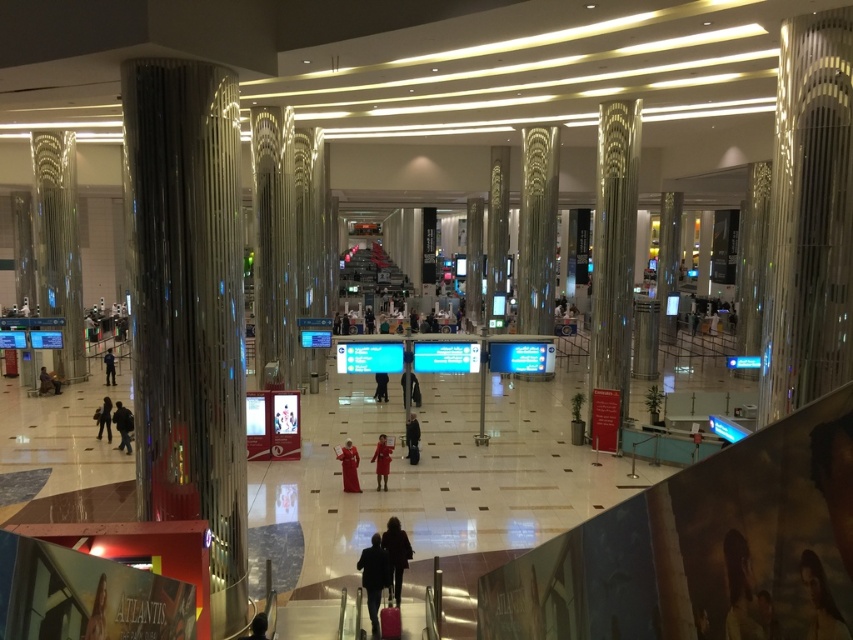
The image size is (853, 640). What do you see at coordinates (189, 308) in the screenshot? I see `metallic column at left` at bounding box center [189, 308].

Does point (194, 172) lie in front of point (103, 417)?

Yes, it is in front of point (103, 417).

Image resolution: width=853 pixels, height=640 pixels. Find the location of `metallic column at left`. metallic column at left is located at coordinates (189, 308).

Consider the image. Does velvet red dress at center have a greater height compared to dark brown leather jacket at lower left?

In fact, velvet red dress at center may be shorter than dark brown leather jacket at lower left.

Can you confirm if velvet red dress at center is shorter than dark brown leather jacket at lower left?

Yes.

This screenshot has height=640, width=853. I want to click on velvet red dress at center, so click(x=349, y=467).

At what (x,y) coordinates should I click in order to perform the action: click on velvet red dress at center. Please return your answer as a coordinate pair (x, y). Looking at the image, I should click on (349, 467).

Does point (352, 472) come in front of point (111, 358)?

Yes, point (352, 472) is closer to viewer.

Measure the distance between point (343, 483) and camera.

Point (343, 483) is 15.28 meters from camera.

The height and width of the screenshot is (640, 853). I want to click on velvet red dress at center, so click(x=349, y=467).